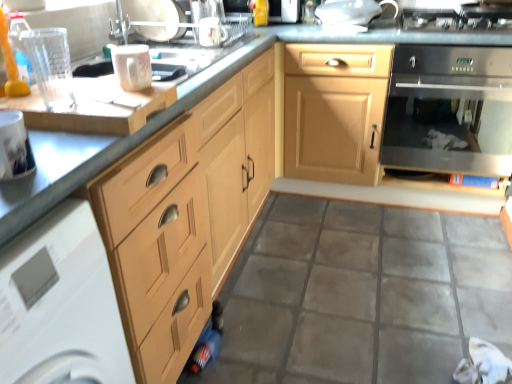
Question: In terms of height, does white glossy mug at upper center, the 2th appliance in the right-to-left sequence, look taller or shorter compared to black metallic gas stove at upper right?

Choices:
 (A) short
 (B) tall

Answer: (B)

Question: Visually, is white glossy mug at upper center, which is counted as the fourth appliance, starting from the back, positioned to the left or to the right of black metallic gas stove at upper right?

Choices:
 (A) left
 (B) right

Answer: (A)

Question: Which is farther from the porcelain glossy mug at upper center, which is counted as the third appliance, starting from the left?

Choices:
 (A) white glossy toaster at upper center, placed as the first appliance when sorted from back to front
 (B) stainless steel oven at right, placed as the second home appliance when sorted from bottom to top
 (C) white glossy mug at left
 (D) white glossy dishwasher at lower left, the second home appliance when ordered from top to bottom
 (E) light wood cabinet at center

Answer: (B)

Question: Considering the real-world distances, which object is farthest from the porcelain glossy mug at upper center, which is counted as the third appliance, starting from the left?

Choices:
 (A) white glossy mug at left
 (B) metallic silver sink at upper center, positioned as the 5th appliance in front-to-back order
 (C) light wood cabinet at center
 (D) clear glass tumbler at upper left, which is the 1th appliance in left-to-right order
 (E) stainless steel oven at right, arranged as the second home appliance when viewed from the front

Answer: (E)